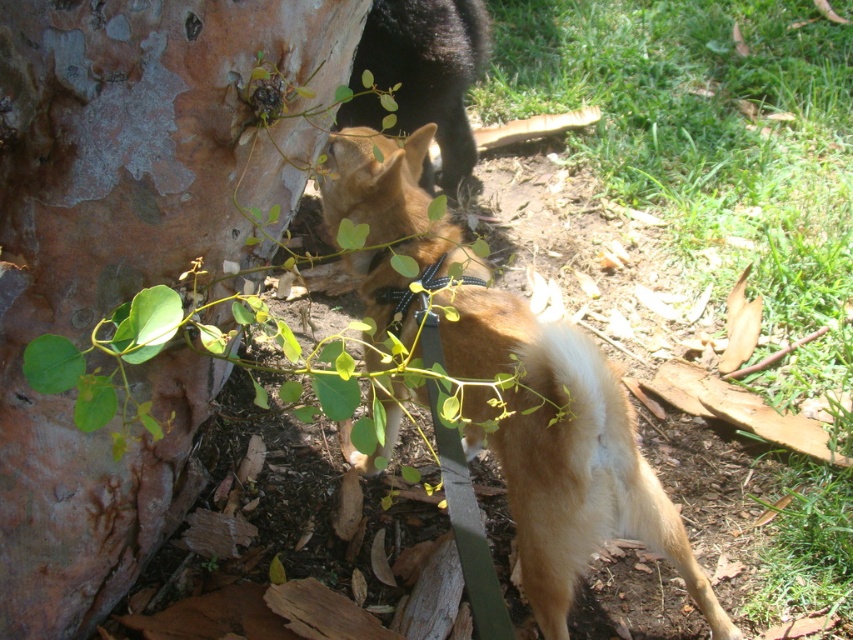
You are a dog owner trying to decide whether to let your golden fur dog at center play near the smooth bark tree trunk at left. Considering their sizes, will the dog fit comfortably next to the tree trunk?

The smooth bark tree trunk at left has a lesser width compared to the golden fur dog at center. Therefore, the dog will have enough space to fit comfortably next to the tree trunk since the trunk is narrower than the dog.

You are standing at the center of the image and want to approach the smooth bark tree trunk at left. In which direction should you move to reach it?

The smooth bark tree trunk at left is located at point (126, 253), so you should move to the left and slightly downward from your current position at the center to reach it.

You are a photographer trying to capture the golden fur dog at center and the smooth bark tree trunk at left in your shot. Can you tell me which object is closer to the camera based on their positions?

The smooth bark tree trunk at left is positioned over the golden fur dog at center, meaning it is closer to the camera.